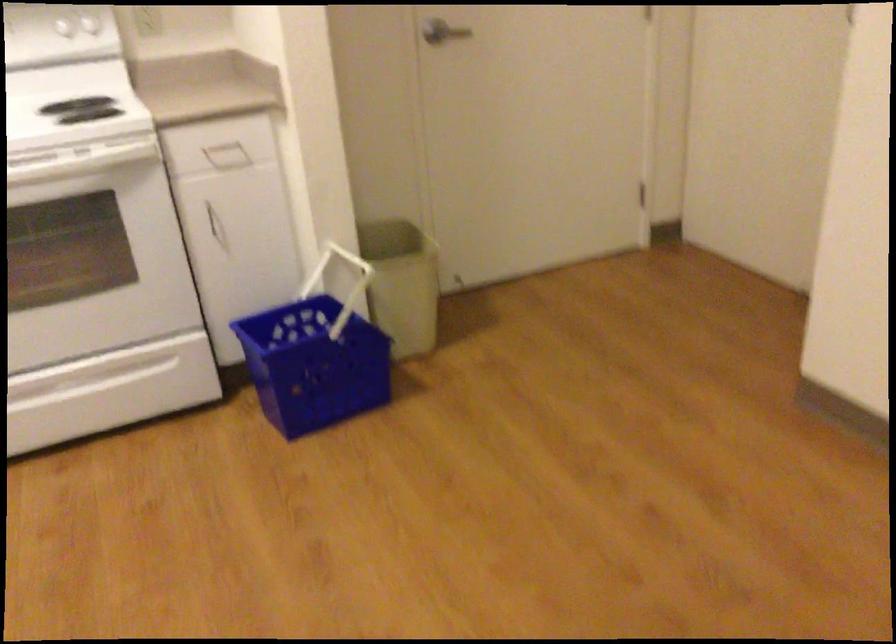
At what (x,y) coordinates should I click in order to perform the action: click on white basket handle. Please return your answer as a coordinate pair (x, y). This screenshot has width=896, height=644. Looking at the image, I should click on (337, 272).